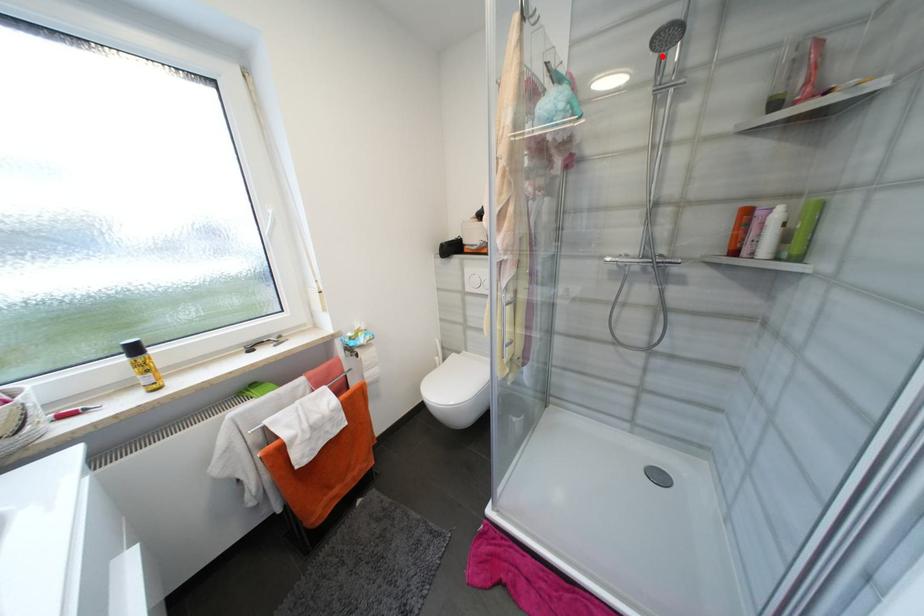
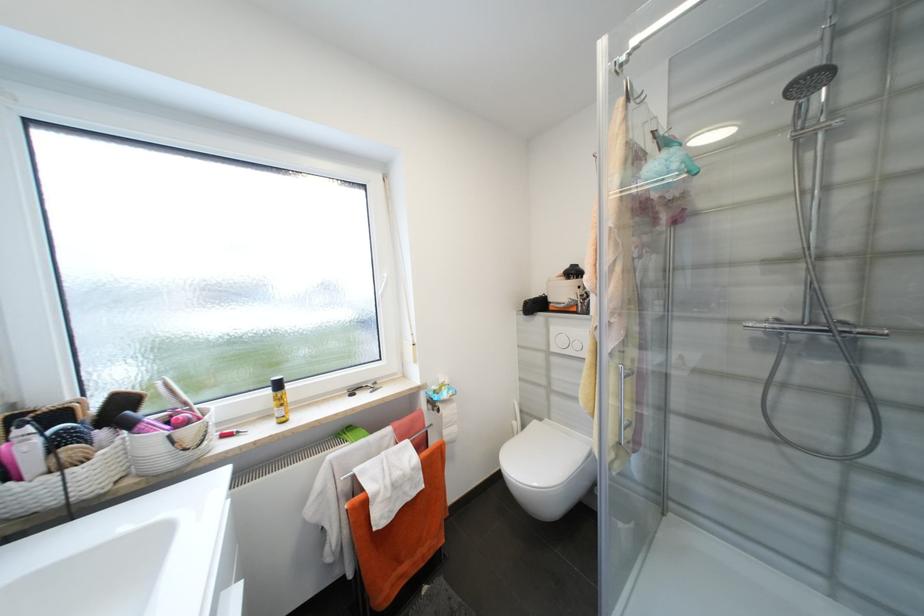
Where in the second image is the point corresponding to the highlighted location from the first image?

(799, 103)